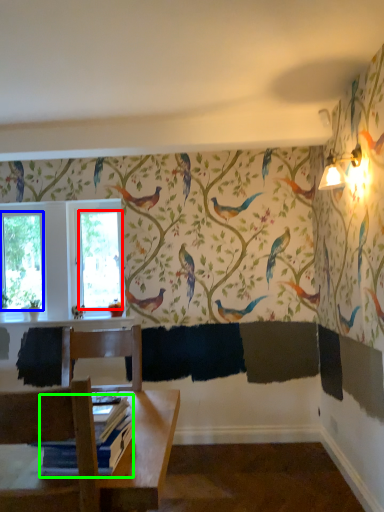
Question: Considering the real-world distances, which object is closest to window screen (highlighted by a red box)? window screen (highlighted by a blue box) or book (highlighted by a green box).

Choices:
 (A) window screen
 (B) book

Answer: (A)